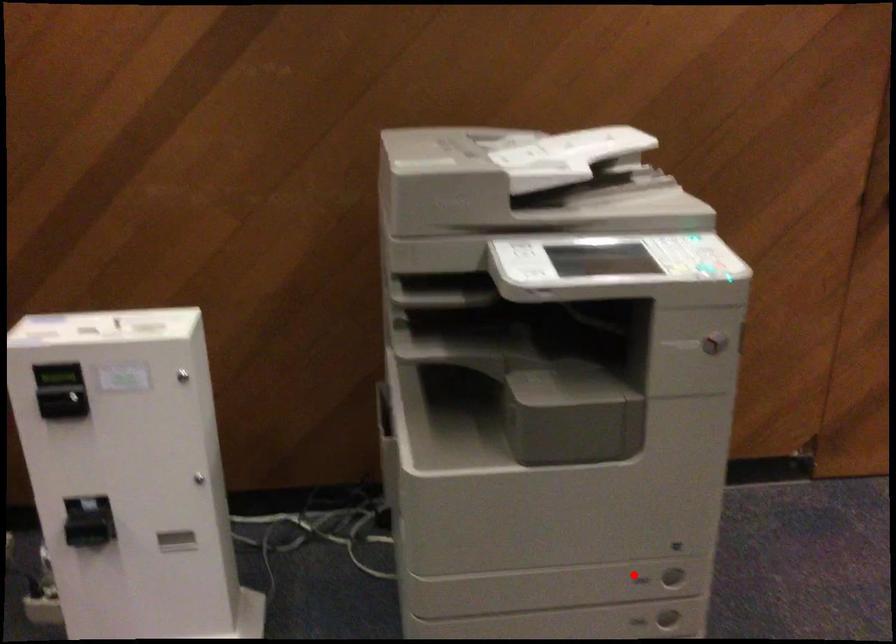
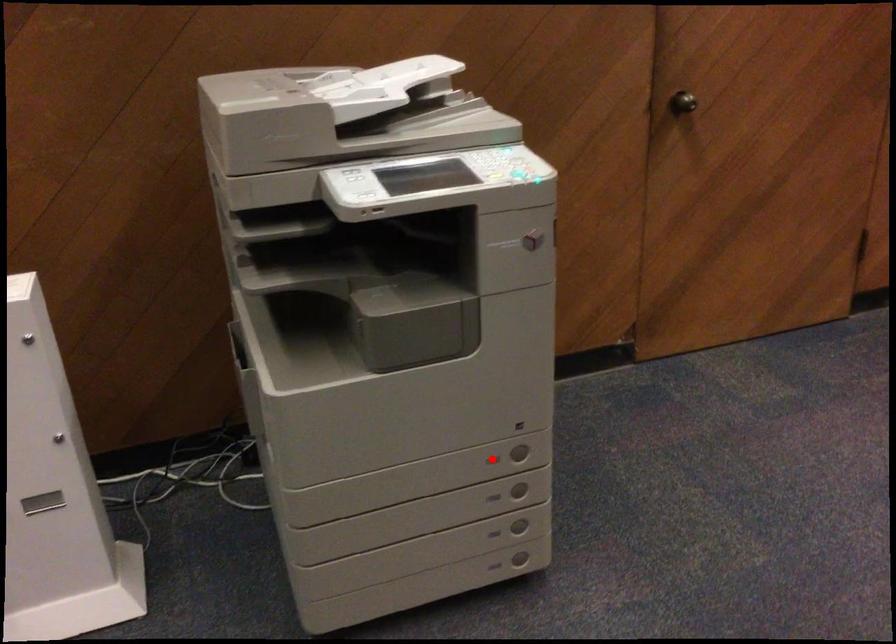
Consider the image. I am providing you with two images of the same scene from different viewpoints. A red point is marked on the first image and another point is marked on the second image. Is the red point in image1 aligned with the point shown in image2?

Yes